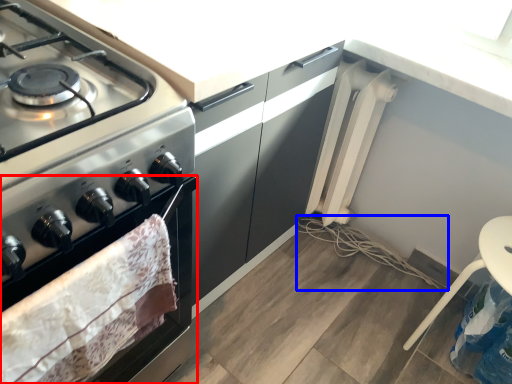
Question: Which object is further to the camera taking this photo, oven (highlighted by a red box) or string (highlighted by a blue box)?

Choices:
 (A) oven
 (B) string

Answer: (B)